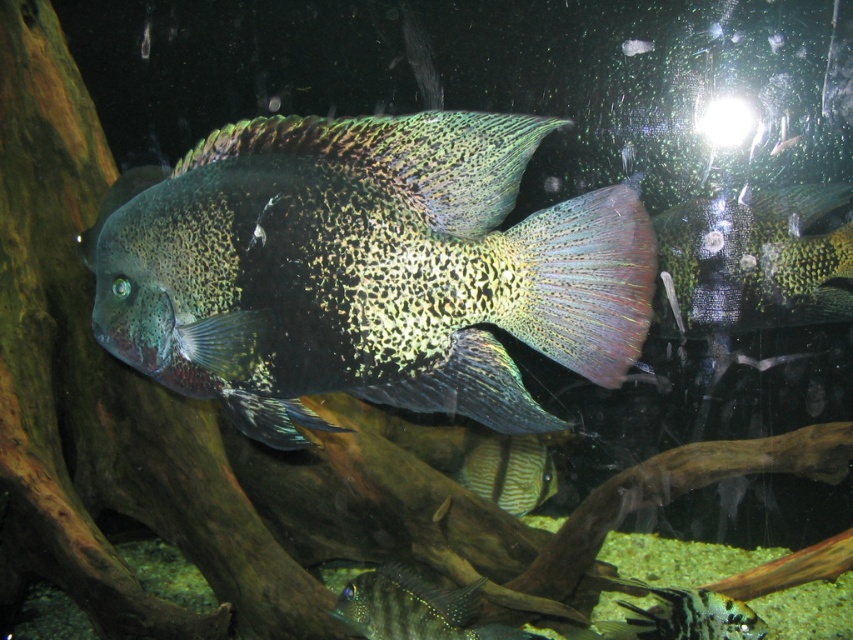
Who is more distant from viewer, [210,369] or [497,454]?

The point [497,454] is behind.

From the picture: Who is positioned more to the left, shiny iridescent fish at center or striped leather fish at center?

shiny iridescent fish at center is more to the left.

Is point (425, 288) positioned after point (511, 451)?

No.

At what (x,y) coordinates should I click in order to perform the action: click on shiny iridescent fish at center. Please return your answer as a coordinate pair (x, y). This screenshot has width=853, height=640. Looking at the image, I should click on (369, 269).

Does shiny blue fish at bottom appear over striped leather fish at center?

No, shiny blue fish at bottom is not above striped leather fish at center.

The height and width of the screenshot is (640, 853). In order to click on shiny blue fish at bottom in this screenshot , I will do `click(408, 605)`.

Between green iridescent fish at right and black and white striped fish at lower right, which one is positioned lower?

black and white striped fish at lower right

Is green iridescent fish at right above black and white striped fish at lower right?

Yes, green iridescent fish at right is above black and white striped fish at lower right.

Who is more distant from viewer, (793, 305) or (660, 596)?

The point (660, 596) is more distant.

Locate an element on the screen. The image size is (853, 640). green iridescent fish at right is located at coordinates (752, 260).